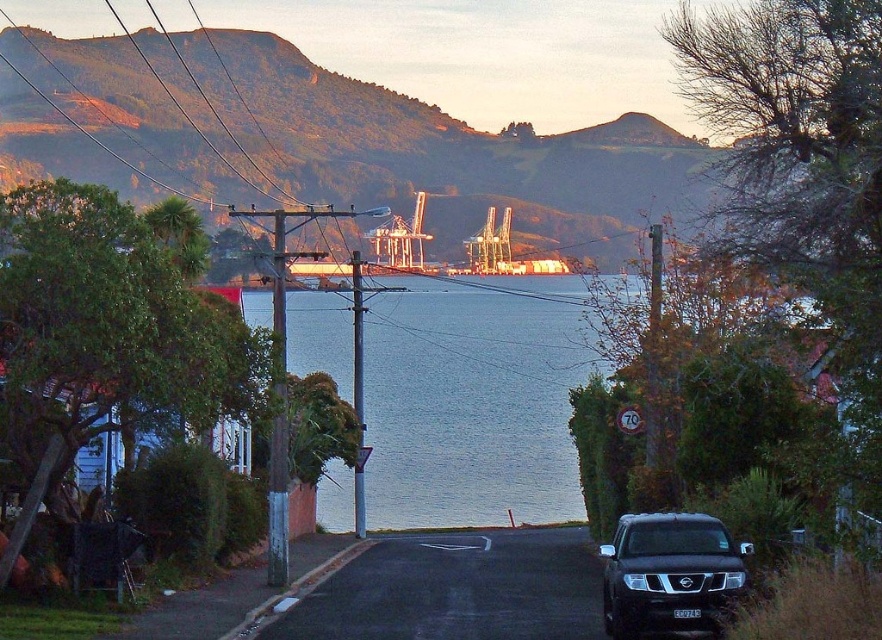
You are standing on the suburban street and want to take a photo of the green textured mountain at upper center and the blue water at center. Which object should you focus on first to ensure both are in the same frame?

You should focus on the green textured mountain at upper center first because it is closer to you than the blue water at center, so adjusting the camera to include both would require ensuring the mountain isn t cropped out while the water remains in view.

You are standing on the suburban street and want to walk from point [258,316] to point [686,563]. Which direction should you face to move towards the point that is further away from you?

You should face the direction of point [686,563] because it is further away from you than point [258,316].

You are standing on the suburban street and want to take a photo of the green textured mountain at upper center without the satin black suv at lower right blocking the view. Is this possible?

The green textured mountain at upper center is further to the viewer than the satin black suv at lower right, so the satin black suv at lower right is closer to you. Therefore, it will block the view of the mountain unless you move to a different position.